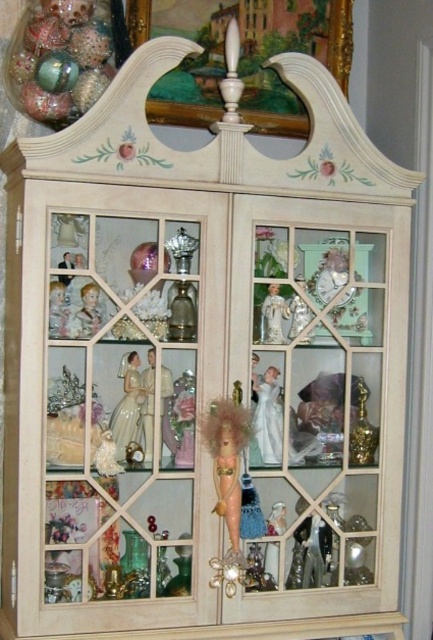
Between white porcelain doll at center and porcelain doll at center, which one has less height?

white porcelain doll at center is shorter.

Is point (268, 388) positioned after point (135, 396)?

Yes, point (268, 388) is farther from viewer.

Where is `white porcelain doll at center`? white porcelain doll at center is located at coordinates (268, 417).

At what (x,y) coordinates should I click in order to perform the action: click on white porcelain doll at center. Please return your answer as a coordinate pair (x, y). The image size is (433, 640). Looking at the image, I should click on (268, 417).

Between point (219, 445) and point (132, 360), which one is positioned behind?

Positioned behind is point (132, 360).

Is shiny gold doll at center above porcelain doll at center?

No.

Does point (232, 541) lie in front of point (122, 406)?

Yes, point (232, 541) is closer to viewer.

At what (x,y) coordinates should I click in order to perform the action: click on shiny gold doll at center. Please return your answer as a coordinate pair (x, y). Image resolution: width=433 pixels, height=640 pixels. Looking at the image, I should click on (226, 458).

The width and height of the screenshot is (433, 640). Describe the element at coordinates (226, 458) in the screenshot. I see `shiny gold doll at center` at that location.

Is shiny gold doll at center to the right of white porcelain doll at center from the viewer's perspective?

In fact, shiny gold doll at center is to the left of white porcelain doll at center.

I want to click on shiny gold doll at center, so click(226, 458).